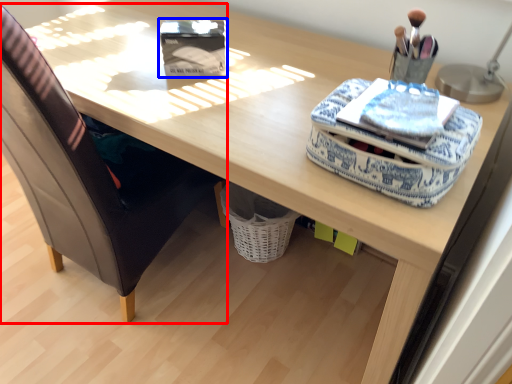
Question: Among these objects, which one is nearest to the camera, chair (highlighted by a red box) or storage box (highlighted by a blue box)?

Choices:
 (A) chair
 (B) storage box

Answer: (A)